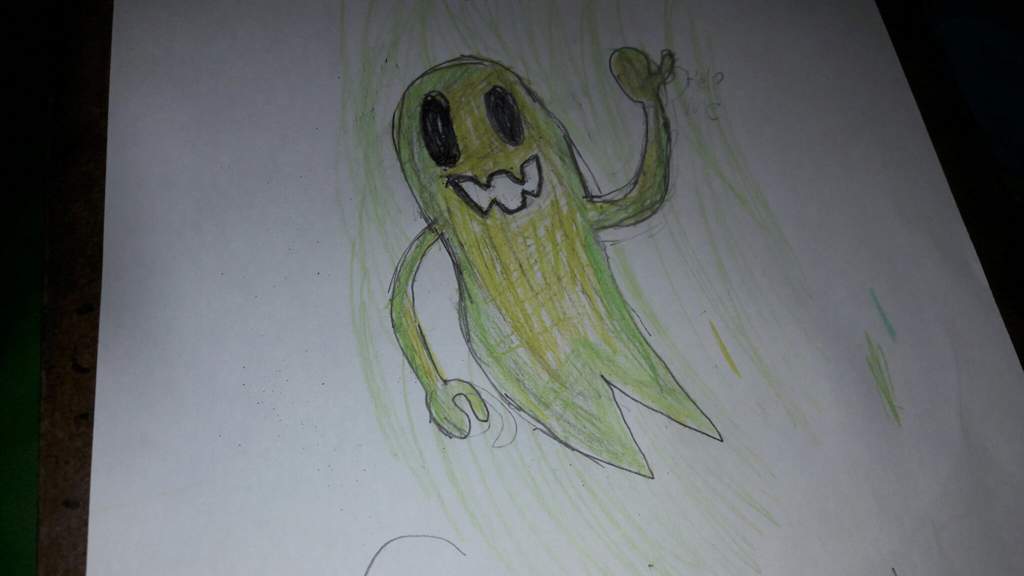
This screenshot has height=576, width=1024. What are the coordinates of `dark green table/surface` in the screenshot? It's located at (8, 393).